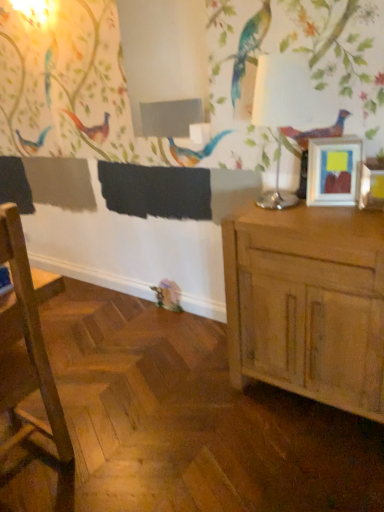
Question: Does white glossy table lamp at upper right have a smaller size compared to light brown wood cabinet at right?

Choices:
 (A) no
 (B) yes

Answer: (B)

Question: From a real-world perspective, is white glossy table lamp at upper right over light brown wood cabinet at right?

Choices:
 (A) no
 (B) yes

Answer: (B)

Question: Are white glossy table lamp at upper right and light brown wood cabinet at right far apart?

Choices:
 (A) yes
 (B) no

Answer: (B)

Question: Considering the relative sizes of white glossy table lamp at upper right and light brown wood cabinet at right in the image provided, is white glossy table lamp at upper right shorter than light brown wood cabinet at right?

Choices:
 (A) no
 (B) yes

Answer: (B)

Question: Is white glossy table lamp at upper right located outside light brown wood cabinet at right?

Choices:
 (A) yes
 (B) no

Answer: (A)

Question: Does white glossy table lamp at upper right turn towards light brown wood cabinet at right?

Choices:
 (A) yes
 (B) no

Answer: (B)

Question: Can you see wooden chair at left touching white glossy table lamp at upper right?

Choices:
 (A) yes
 (B) no

Answer: (B)

Question: From the image's perspective, is wooden chair at left located beneath white glossy table lamp at upper right?

Choices:
 (A) yes
 (B) no

Answer: (A)

Question: Can you confirm if wooden chair at left is taller than white glossy table lamp at upper right?

Choices:
 (A) yes
 (B) no

Answer: (A)

Question: Is white glossy table lamp at upper right at the back of wooden chair at left?

Choices:
 (A) yes
 (B) no

Answer: (B)

Question: Is wooden chair at left shorter than white glossy table lamp at upper right?

Choices:
 (A) no
 (B) yes

Answer: (A)

Question: Is wooden chair at left smaller than white glossy table lamp at upper right?

Choices:
 (A) yes
 (B) no

Answer: (B)

Question: Could wooden chair at left be considered to be inside light brown wood cabinet at right?

Choices:
 (A) yes
 (B) no

Answer: (B)